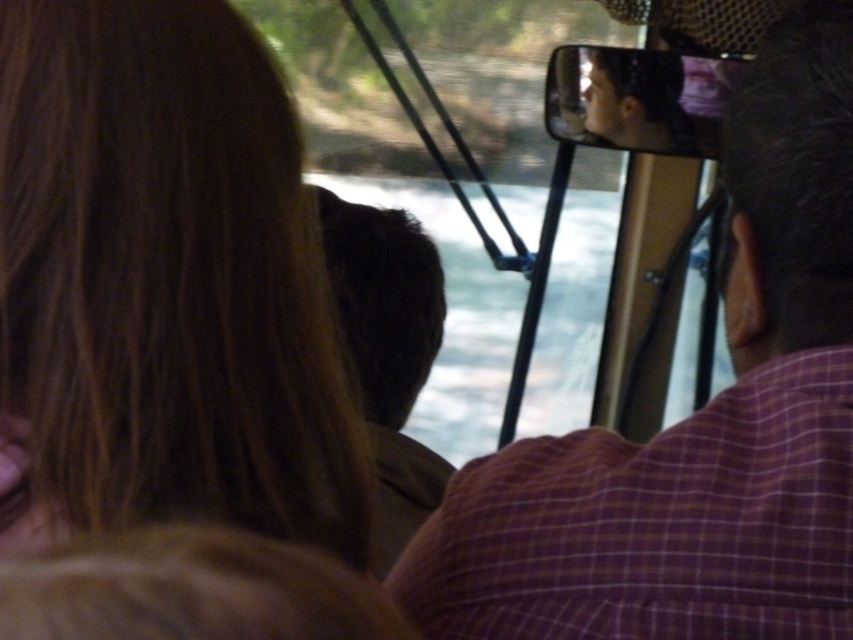
Question: Which is nearer to the brown hair at center?

Choices:
 (A) blonde hair at left
 (B) purple checkered shirt at upper right

Answer: (B)

Question: Which of the following is the closest to the observer?

Choices:
 (A) blonde hair at left
 (B) purple checkered shirt at upper right
 (C) brown hair at center

Answer: (A)

Question: Observing the image, what is the correct spatial positioning of purple checkered shirt at upper right in reference to brown hair at center?

Choices:
 (A) right
 (B) left

Answer: (A)

Question: Is blonde hair at left further to camera compared to brown hair at center?

Choices:
 (A) no
 (B) yes

Answer: (A)

Question: Can you confirm if blonde hair at left is positioned to the left of purple checkered shirt at upper right?

Choices:
 (A) no
 (B) yes

Answer: (B)

Question: Which object appears farthest from the camera in this image?

Choices:
 (A) blonde hair at left
 (B) purple checkered shirt at upper right

Answer: (B)